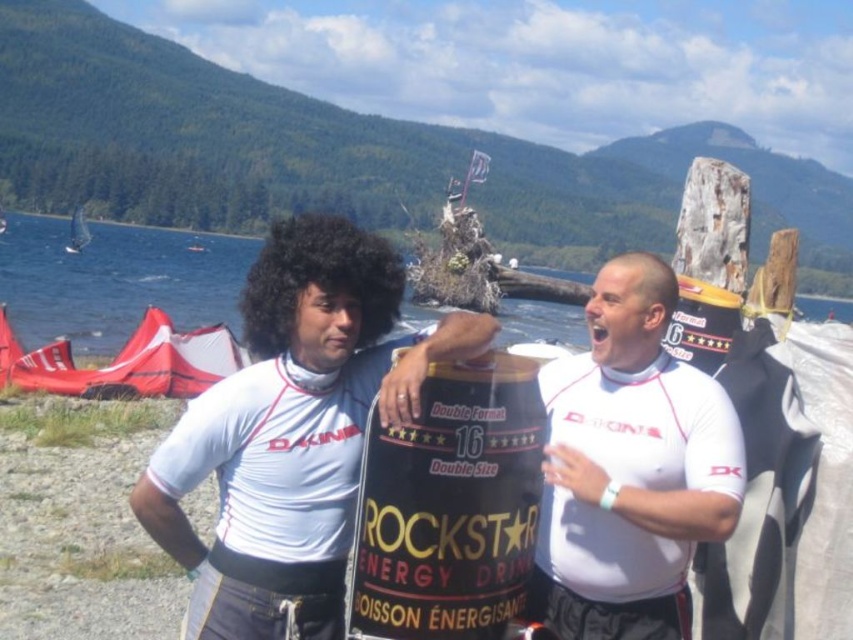
Question: Which of the following is the closest to the observer?

Choices:
 (A) black matte energy drink can at center
 (B) white matte shirt at center

Answer: (B)

Question: Does matte black energy drink can at center have a smaller size compared to black matte energy drink can at center?

Choices:
 (A) yes
 (B) no

Answer: (A)

Question: Can you confirm if matte black energy drink can at center is positioned above white matte shirt at center?

Choices:
 (A) no
 (B) yes

Answer: (A)

Question: Is matte black energy drink can at center above white matte shirt at center?

Choices:
 (A) no
 (B) yes

Answer: (A)

Question: Among these objects, which one is nearest to the camera?

Choices:
 (A) matte black energy drink can at center
 (B) black matte energy drink can at center

Answer: (A)

Question: Which point is farther to the camera?

Choices:
 (A) (706, 397)
 (B) (198, 257)

Answer: (B)